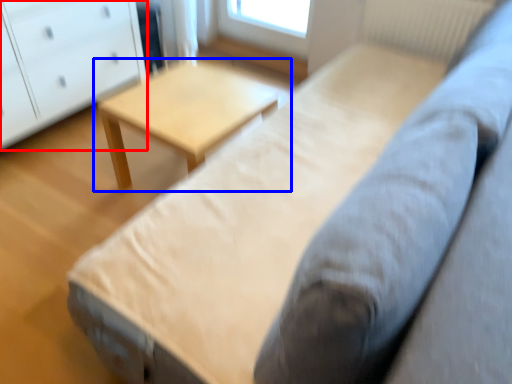
Question: Among these objects, which one is nearest to the camera, chest of drawers (highlighted by a red box) or table (highlighted by a blue box)?

Choices:
 (A) chest of drawers
 (B) table

Answer: (B)